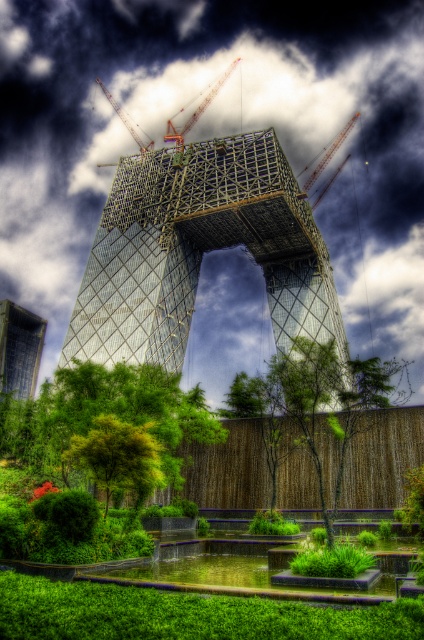
You are an architect planning to place a new sculpture in the garden. The sculpture requires a space that can accommodate the green leafy tree at center and the glassy transparent tower at lower left. Which object should you consider for the sculpture placement based on their sizes?

The green leafy tree at center is larger in size than the glassy transparent tower at lower left, so you should consider placing the sculpture around the green leafy tree at center to ensure there is enough space.

You are an architect reviewing the construction site. You notice the white fluffy cloud at upper center and the green leafy tree at lower left. Which object is wider in the image?

The white fluffy cloud at upper center might be wider than green leafy tree at lower left according to the description.